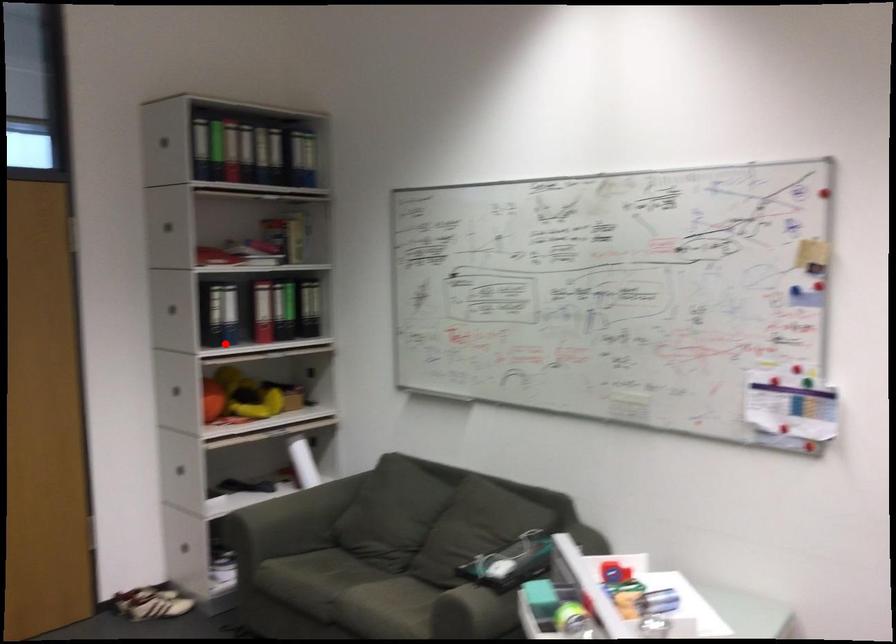
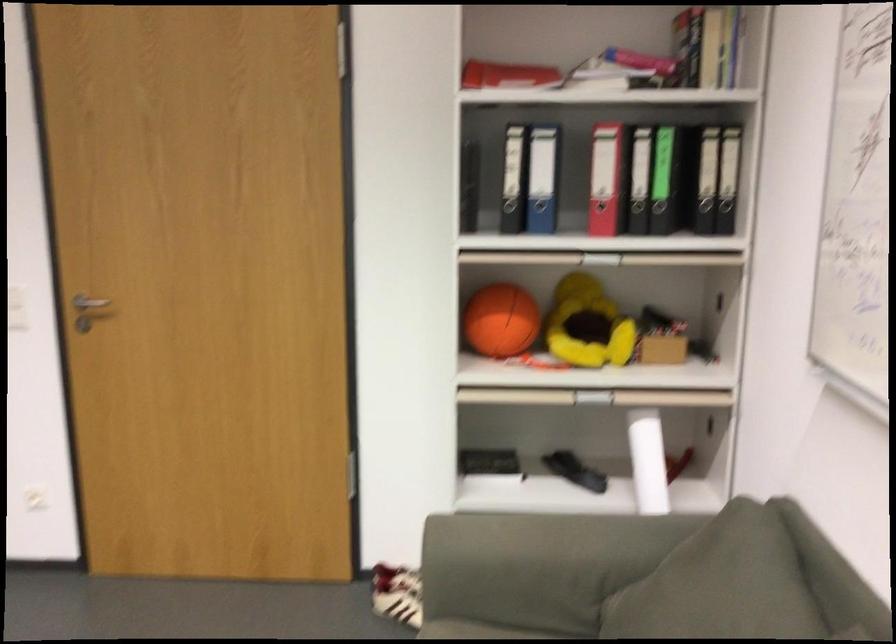
The point at the highlighted location is marked in the first image. Where is the corresponding point in the second image?

(539, 216)